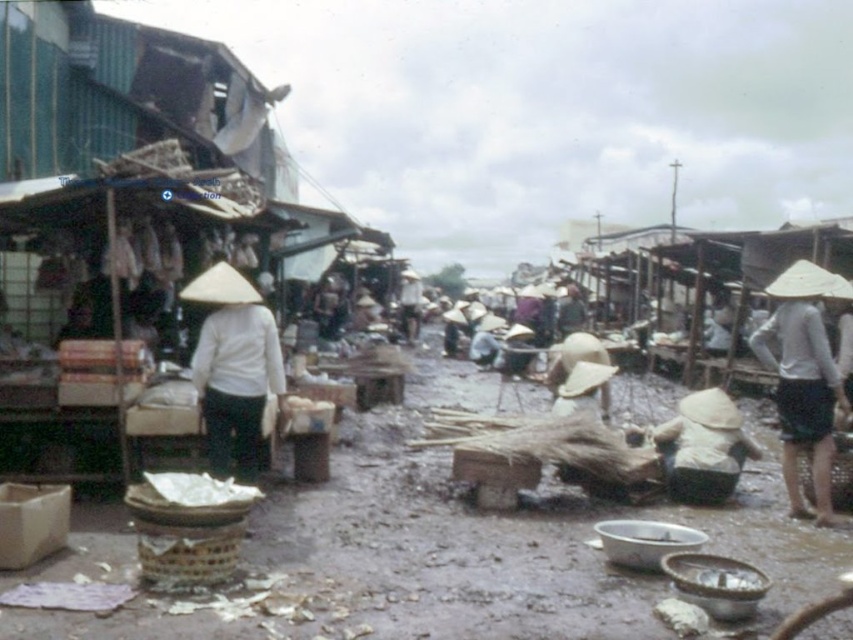
Question: Which object appears closest to the camera in this image?

Choices:
 (A) white woven hat at right
 (B) white matte conical hat at center
 (C) white straw hat at lower center

Answer: (B)

Question: Which of the following is the closest to the observer?

Choices:
 (A) (787, 456)
 (B) (267, 372)
 (C) (721, 420)

Answer: (B)

Question: Which point appears farthest from the camera in this image?

Choices:
 (A) click(633, 433)
 (B) click(769, 368)
 (C) click(260, 392)

Answer: (A)

Question: Can you confirm if white matte conical hat at center is positioned to the left of white woven hat at right?

Choices:
 (A) yes
 (B) no

Answer: (A)

Question: Does white woven hat at right have a lesser width compared to white straw hat at lower center?

Choices:
 (A) no
 (B) yes

Answer: (B)

Question: Is white matte conical hat at center further to camera compared to white straw hat at lower center?

Choices:
 (A) yes
 (B) no

Answer: (B)